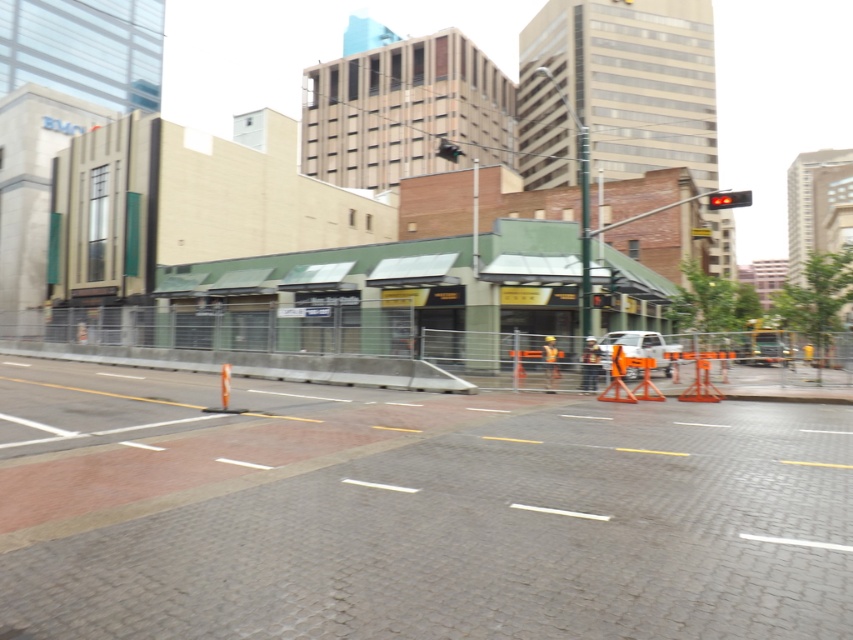
Question: Is white matte truck at center further to the viewer compared to red plastic traffic light at center?

Choices:
 (A) no
 (B) yes

Answer: (A)

Question: In this image, where is white matte truck at center located relative to red plastic traffic light at center?

Choices:
 (A) left
 (B) right

Answer: (B)

Question: Is brick pavement at center wider than red plastic traffic light at center?

Choices:
 (A) yes
 (B) no

Answer: (A)

Question: Which point is closer to the camera?

Choices:
 (A) (605, 298)
 (B) (625, 528)
 (C) (675, 346)

Answer: (B)

Question: Estimate the real-world distances between objects in this image. Which object is closer to the white matte truck at center?

Choices:
 (A) brick pavement at center
 (B) red plastic traffic light at center
 (C) red plastic traffic light at upper right

Answer: (B)

Question: Which object is the farthest from the brick pavement at center?

Choices:
 (A) white matte truck at center
 (B) red plastic traffic light at center
 (C) red plastic traffic light at upper right

Answer: (C)